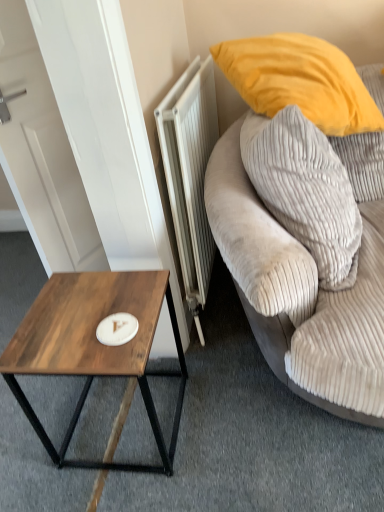
Question: Looking at the image, does white metallic radiator at center seem bigger or smaller compared to velvet grey couch at right?

Choices:
 (A) small
 (B) big

Answer: (A)

Question: Which is correct: white metallic radiator at center is inside velvet grey couch at right, or outside of it?

Choices:
 (A) inside
 (B) outside

Answer: (B)

Question: Estimate the real-world distances between objects in this image. Which object is closer to the wooden coffee table at lower left?

Choices:
 (A) white metallic radiator at center
 (B) velvet gray pillow at upper right
 (C) white matte plate at center
 (D) velvet grey couch at right

Answer: (C)

Question: Which object is the farthest from the white metallic radiator at center?

Choices:
 (A) velvet grey couch at right
 (B) wooden coffee table at lower left
 (C) white matte plate at center
 (D) velvet gray pillow at upper right

Answer: (C)